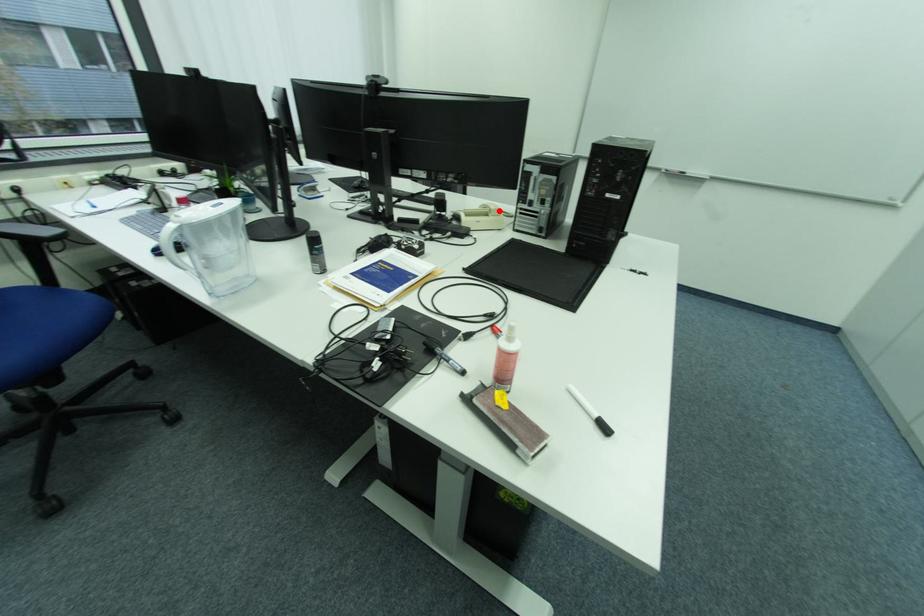
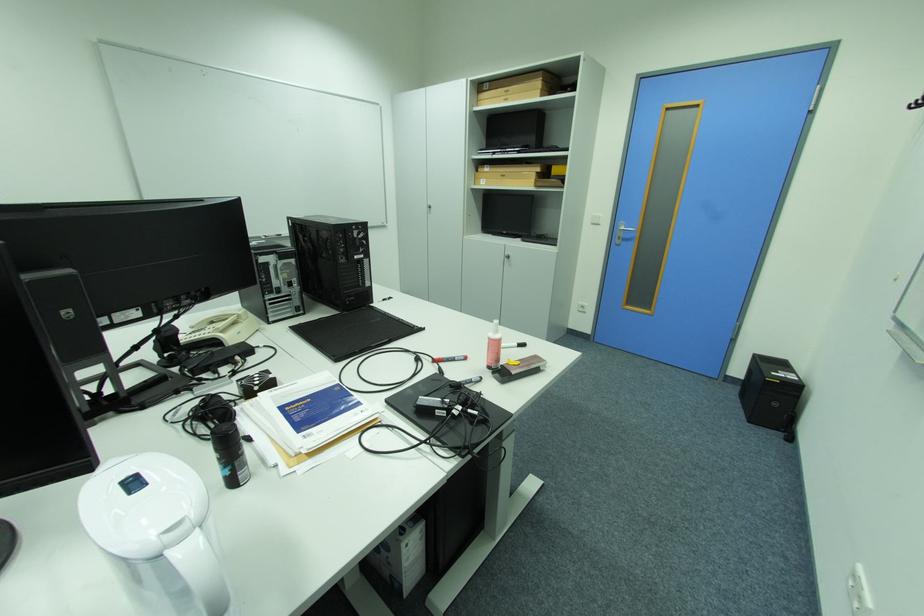
Find the pixel in the second image that matches the highlighted location in the first image.

(247, 315)